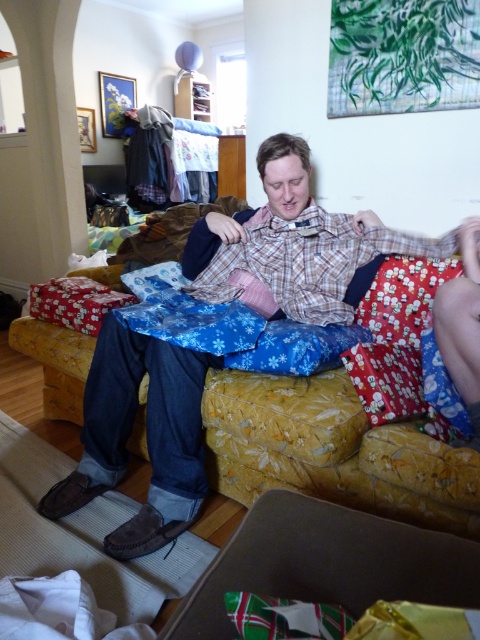
Question: Is yellow floral fabric couch at center above green paper gift at lower center?

Choices:
 (A) no
 (B) yes

Answer: (B)

Question: Which point is closer to the camera?

Choices:
 (A) (231, 586)
 (B) (442, 452)

Answer: (A)

Question: Which point is closer to the camera?

Choices:
 (A) click(x=435, y=444)
 (B) click(x=336, y=586)

Answer: (B)

Question: Can you confirm if yellow floral fabric couch at center is smaller than green paper gift at lower center?

Choices:
 (A) yes
 (B) no

Answer: (B)

Question: Observing the image, what is the correct spatial positioning of yellow floral fabric couch at center in reference to green paper gift at lower center?

Choices:
 (A) right
 (B) left

Answer: (A)